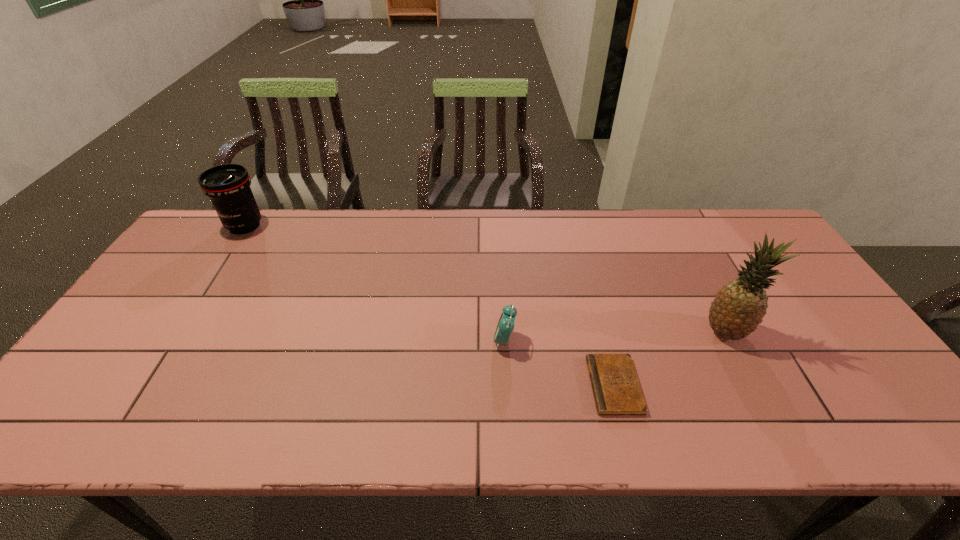
Find the location of a particular element. The image size is (960, 540). pineapple is located at coordinates (739, 307).

The width and height of the screenshot is (960, 540). What are the coordinates of `the tallest object` in the screenshot? It's located at (739, 307).

Where is `the leftmost object`? The height and width of the screenshot is (540, 960). the leftmost object is located at coordinates (228, 185).

Find the location of `the second tallest object`. the second tallest object is located at coordinates (228, 185).

Find the location of a particular element. alarm clock is located at coordinates point(505,326).

Where is `the third object from right to left`? The image size is (960, 540). the third object from right to left is located at coordinates (505, 326).

Where is `the shortest object`? The height and width of the screenshot is (540, 960). the shortest object is located at coordinates (616, 389).

At what (x,y) coordinates should I click in order to perform the action: click on the nearest object. Please return your answer as a coordinate pair (x, y). This screenshot has height=540, width=960. Looking at the image, I should click on (616, 389).

At what (x,y) coordinates should I click in order to perform the action: click on free space located 0.110m on the left of the pineapple. Please return your answer as a coordinate pair (x, y). This screenshot has width=960, height=540. Looking at the image, I should click on (661, 332).

Image resolution: width=960 pixels, height=540 pixels. I want to click on free space located on the front of the leftmost object, so click(x=179, y=328).